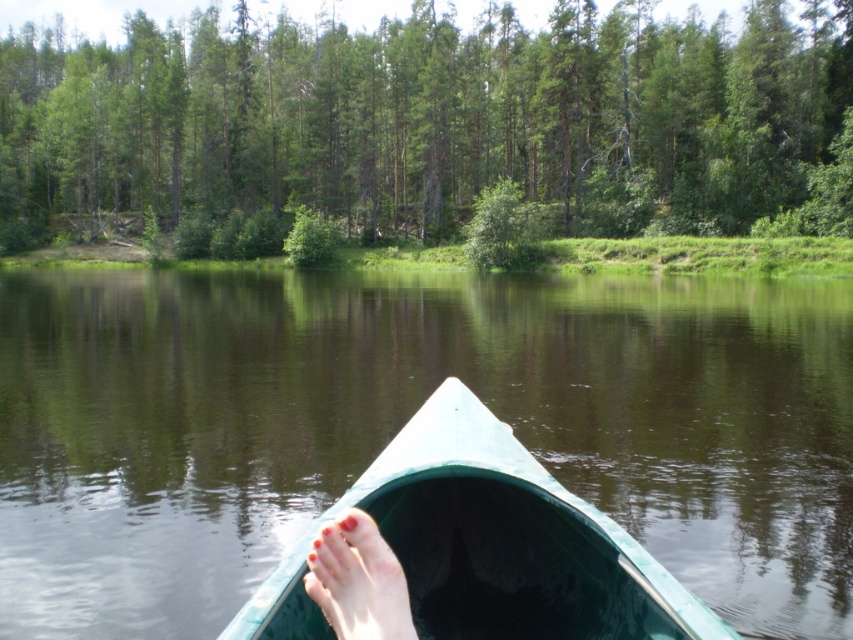
Between point (277, 586) and point (386, 621), which one is positioned behind?

Positioned behind is point (277, 586).

Does point (508, 451) come farther from viewer compared to point (323, 595)?

Yes, point (508, 451) is farther from viewer.

Which is in front, point (664, 620) or point (329, 608)?

Point (329, 608) is more forward.

The width and height of the screenshot is (853, 640). I want to click on green plastic boat at center, so click(x=486, y=545).

Does green smooth water at center have a lesser width compared to green plastic boat at center?

No.

Where is `green smooth water at center`? Image resolution: width=853 pixels, height=640 pixels. green smooth water at center is located at coordinates (403, 422).

Can you confirm if green leafy tree at upper center is taller than smooth pink skin at lower center?

Yes.

Who is taller, green leafy tree at upper center or smooth pink skin at lower center?

green leafy tree at upper center is taller.

What are the coordinates of `green leafy tree at upper center` in the screenshot? It's located at (432, 122).